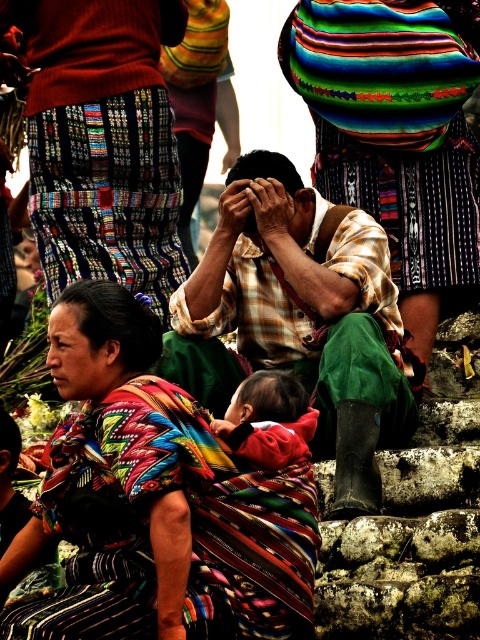
Does red fabric baby at center lie behind matte black forehead at center?

No, red fabric baby at center is in front of matte black forehead at center.

Does red fabric baby at center appear over matte black forehead at center?

No.

Is point (252, 442) positioned in front of point (60, 330)?

Yes, it is in front of point (60, 330).

Identify the location of red fabric baby at center. Image resolution: width=480 pixels, height=640 pixels. coord(268,420).

Describe the element at coordinates (156, 502) in the screenshot. I see `multicolored woven fabric at lower left` at that location.

Between point (20, 532) and point (277, 445), which one is positioned in front?

Positioned in front is point (277, 445).

Identify the location of multicolored woven fabric at lower left. This screenshot has width=480, height=640. (156, 502).

Which is behind, point (241, 513) or point (63, 314)?

The point (63, 314) is more distant.

Can you confirm if multicolored woven fabric at lower left is smaller than matte black forehead at center?

No, multicolored woven fabric at lower left is not smaller than matte black forehead at center.

Find the location of a particular element. multicolored woven fabric at lower left is located at coordinates (156, 502).

At what (x,y) coordinates should I click in order to perform the action: click on multicolored woven fabric at lower left. Please return your answer as a coordinate pair (x, y). The height and width of the screenshot is (640, 480). Looking at the image, I should click on (156, 502).